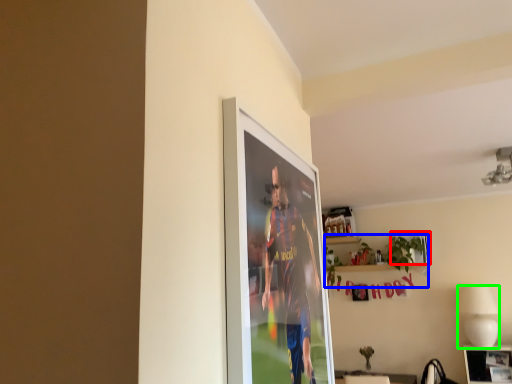
Question: Which object is the farthest from picture frame (highlighted by a red box)? Choose among these: houseplant (highlighted by a blue box) or lamp (highlighted by a green box).

Choices:
 (A) houseplant
 (B) lamp

Answer: (B)